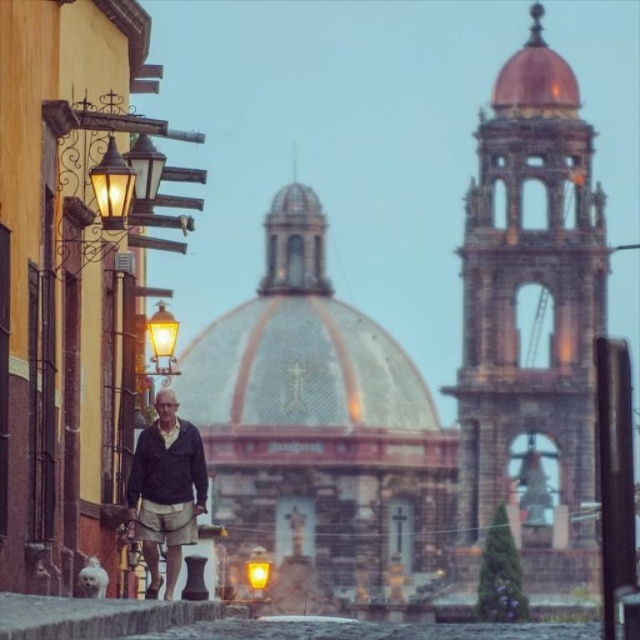
Question: Does matte gold streetlamp at left come behind matte yellow streetlamp at center?

Choices:
 (A) no
 (B) yes

Answer: (A)

Question: Does dark gray jacket at center appear under matte gold streetlamp at left?

Choices:
 (A) no
 (B) yes

Answer: (B)

Question: Which point is closer to the camera?

Choices:
 (A) dark gray jacket at center
 (B) matte yellow streetlamp at center

Answer: (A)

Question: Which is nearer to the dark gray jacket at center?

Choices:
 (A) matte yellow streetlamp at center
 (B) beige cotton kilt at lower center

Answer: (B)

Question: From the image, what is the correct spatial relationship of dark gray jacket at center in relation to beige cotton kilt at lower center?

Choices:
 (A) below
 (B) above

Answer: (B)

Question: Which of the following is the closest to the observer?

Choices:
 (A) dark gray jacket at center
 (B) beige cotton kilt at lower center

Answer: (A)